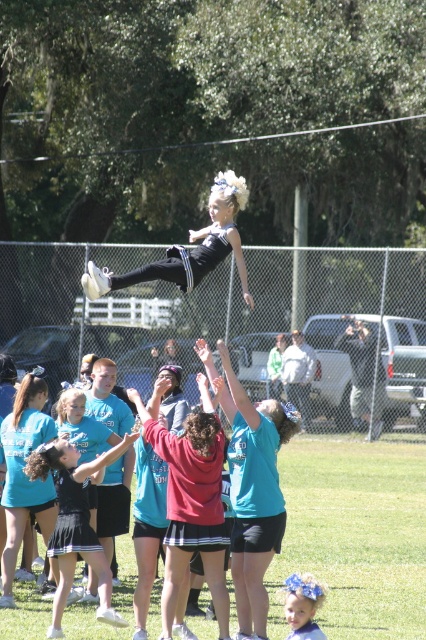
You are a photographer standing at the edge of the green grass football field at center. You want to take a photo of the black matte leotard at center. Which object is closer to your camera lens?

The green grass football field at center is closer to the viewer than the black matte leotard at center, so the green grass football field at center will appear closer to the camera lens.